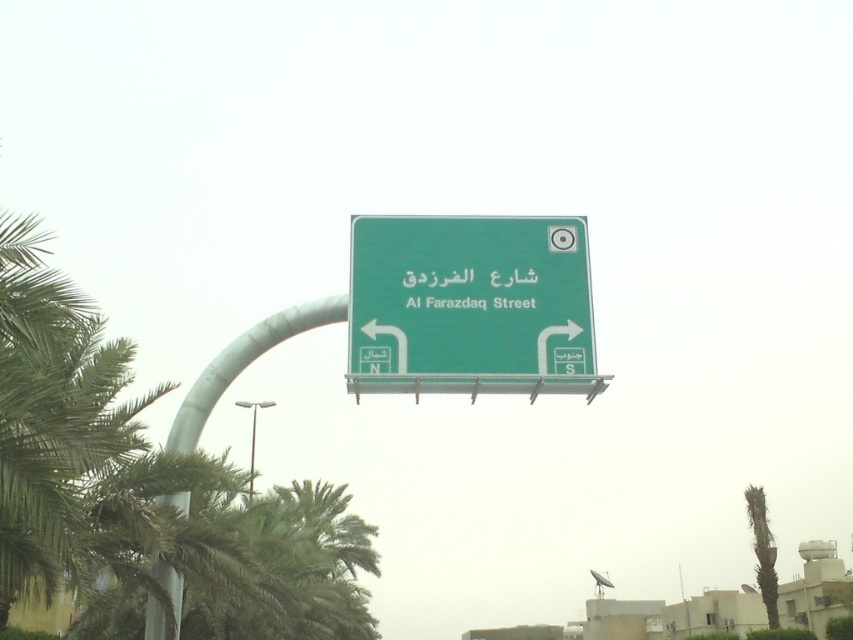
Question: Considering the relative positions of green matte signboard at center and green metallic sign at center in the image provided, where is green matte signboard at center located with respect to green metallic sign at center?

Choices:
 (A) right
 (B) left

Answer: (A)

Question: Which point appears closest to the camera in this image?

Choices:
 (A) (456, 280)
 (B) (349, 308)

Answer: (B)

Question: Is green matte signboard at center to the left of green metallic sign at center from the viewer's perspective?

Choices:
 (A) yes
 (B) no

Answer: (B)

Question: Which point is closer to the camera?

Choices:
 (A) (503, 262)
 (B) (448, 276)

Answer: (B)

Question: Can you confirm if green matte signboard at center is positioned above green metallic sign at center?

Choices:
 (A) yes
 (B) no

Answer: (B)